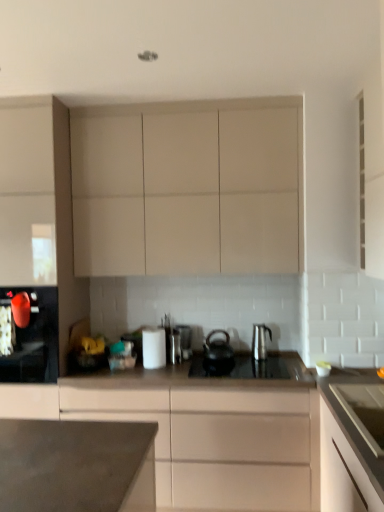
Question: In terms of width, does matte beige cabinet at center, which is the second cabinetry from right to left, look wider or thinner when compared to matte black kettle at left, marked as the first kitchen appliance in a left-to-right arrangement?

Choices:
 (A) wide
 (B) thin

Answer: (A)

Question: Is matte beige cabinet at center, which is the second cabinetry from right to left, in front of or behind matte black kettle at left, the 3th kitchen appliance from the right, in the image?

Choices:
 (A) behind
 (B) front

Answer: (B)

Question: Considering the real-world distances, which object is closest to the matte beige cabinet at center, placed as the 3th cabinetry when sorted from left to right?

Choices:
 (A) satin silver toaster at center
 (B) white glossy paper towel at center, which is the second kitchen appliance from left to right
 (C) matte black kettle at left, the 3th kitchen appliance from the right
 (D) black matte tea pot at center
 (E) white matte cabinet at right, arranged as the 1th cabinetry when viewed from the right

Answer: (B)

Question: Which of these objects is positioned closest to the matte white cabinet at left, the 1th cabinetry from the left?

Choices:
 (A) satin silver kettle at center, the 3th kitchen appliance in the left-to-right sequence
 (B) matte beige cabinet at upper center, placed as the 3th cabinetry when sorted from right to left
 (C) black glass gas stove at center
 (D) matte beige cabinet at center, placed as the 3th cabinetry when sorted from left to right
 (E) satin silver toaster at center

Answer: (B)